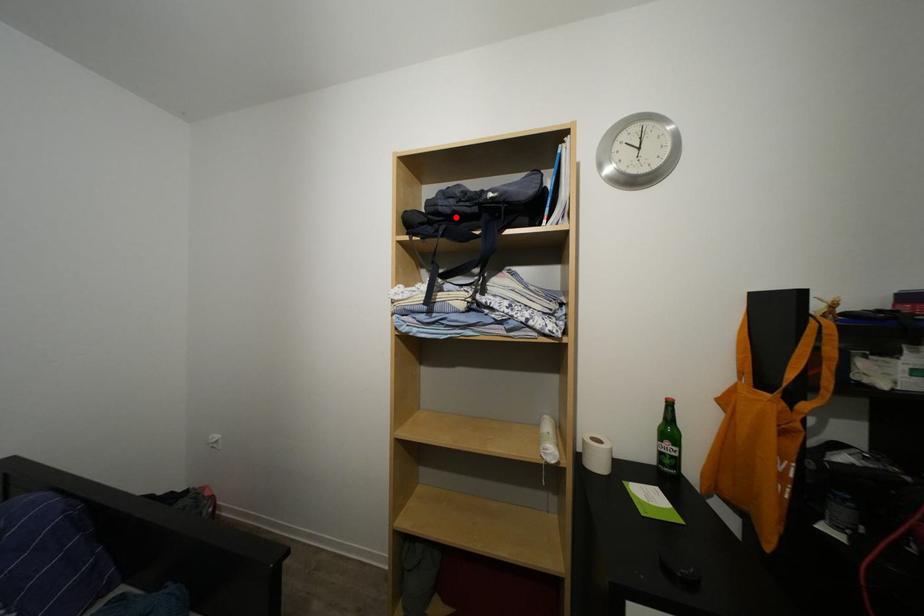
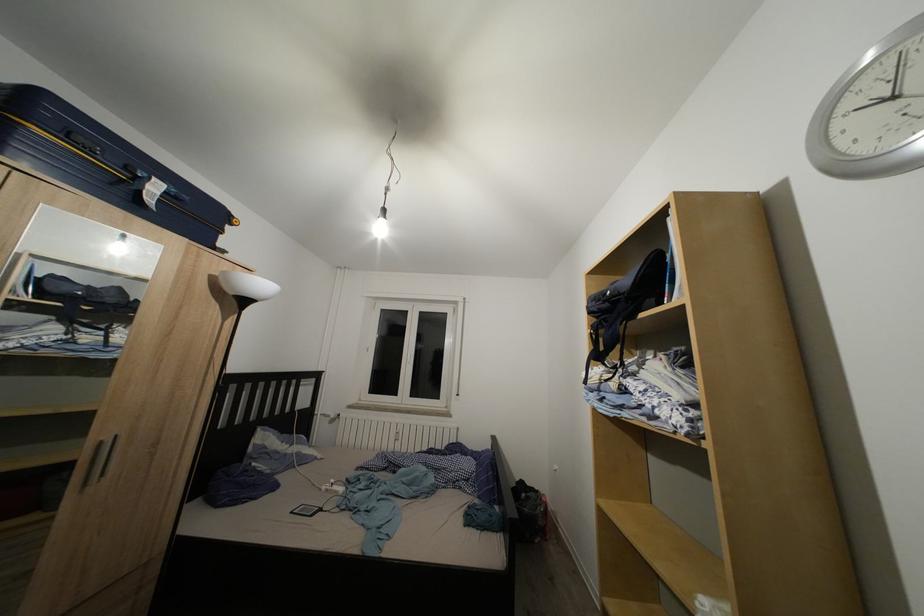
Where in the second image is the point corresponding to the highlighted location from the first image?

(602, 315)